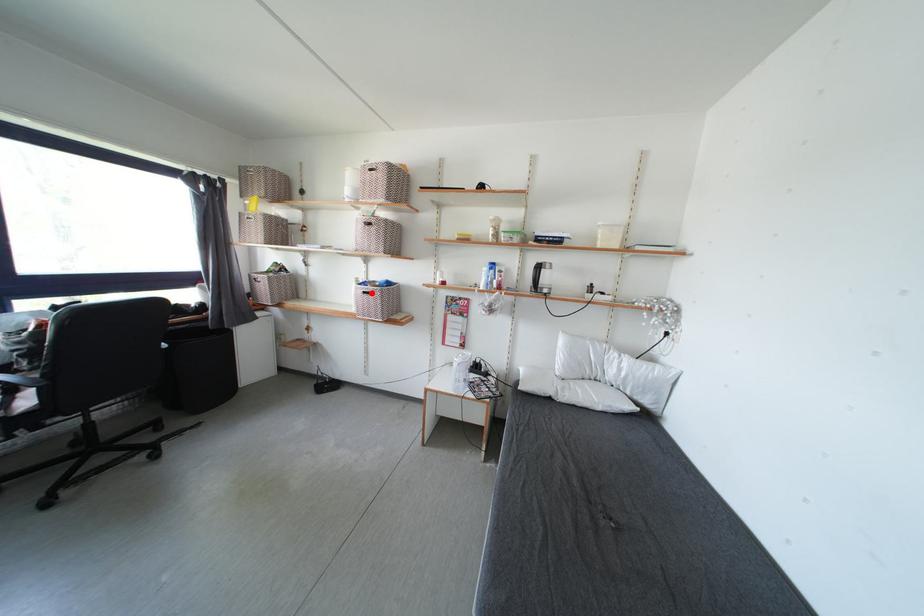
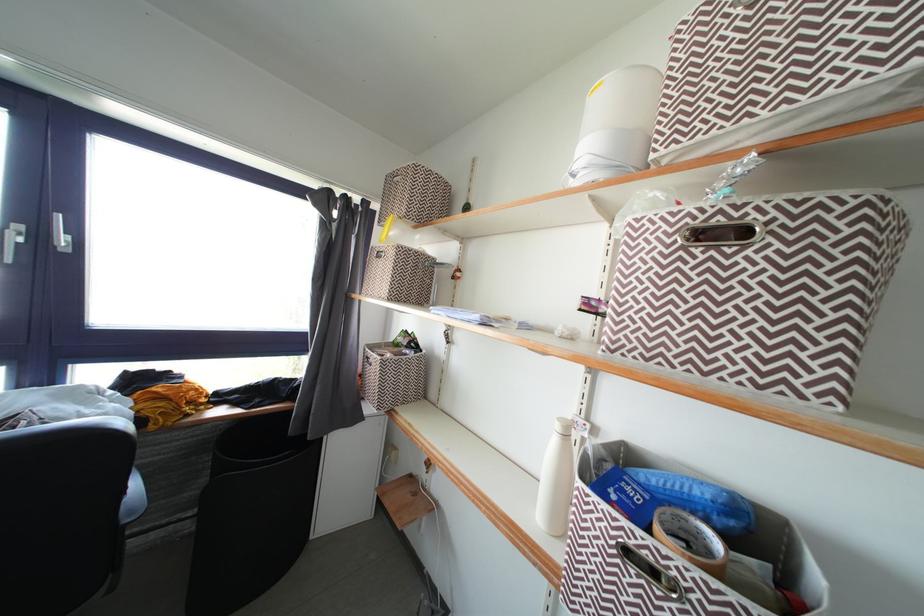
The point at the highlighted location is marked in the first image. Where is the corresponding point in the second image?

(643, 541)